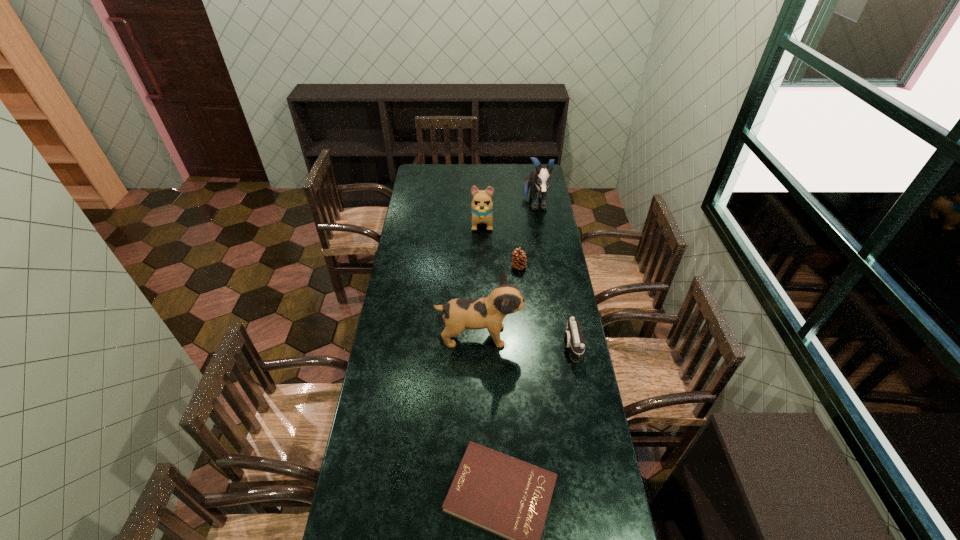
Identify the location of the rightmost puppy. This screenshot has width=960, height=540. (539, 179).

The width and height of the screenshot is (960, 540). Find the location of `the nearest puppy`. the nearest puppy is located at coordinates tap(459, 314).

This screenshot has width=960, height=540. Find the location of `the fourth shortest object`. the fourth shortest object is located at coordinates (482, 206).

Image resolution: width=960 pixels, height=540 pixels. I want to click on pinecone, so click(x=518, y=257).

Where is `camera`? camera is located at coordinates (573, 338).

Identify the location of vacant space located on the front-facing side of the rightmost puppy. The image size is (960, 540). (541, 247).

Locate an element on the screen. The width and height of the screenshot is (960, 540). vacant area situated 0.060m at the face of the nearest puppy is located at coordinates (536, 336).

Find the location of a particular element. This screenshot has width=960, height=540. vacant space situated 0.220m on the face of the fourth shortest object is located at coordinates (483, 262).

Locate an element on the screen. The width and height of the screenshot is (960, 540). vacant region located 0.230m on the back of the third farthest object is located at coordinates (516, 233).

Find the location of `vacant space located 0.400m on the front lens of the camera`. vacant space located 0.400m on the front lens of the camera is located at coordinates [x=466, y=346].